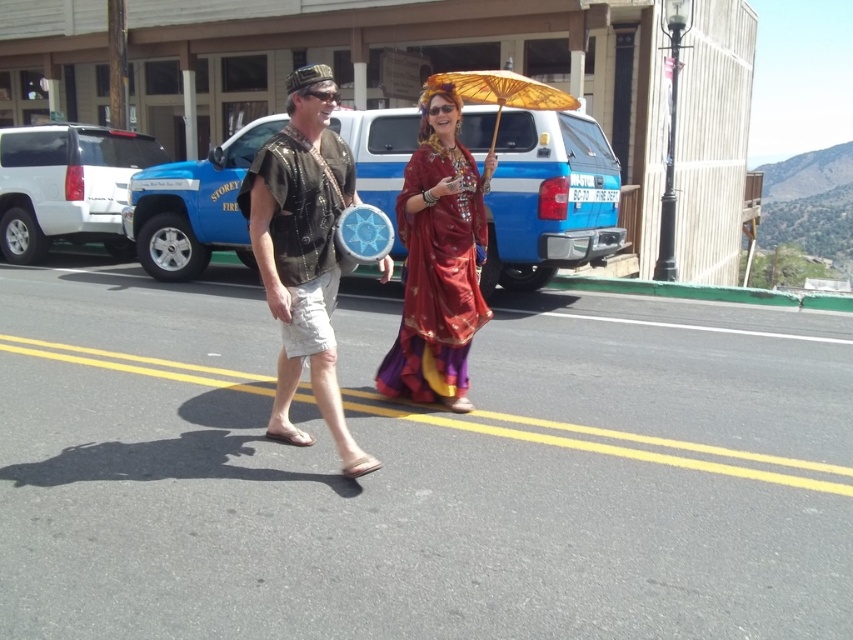
This screenshot has height=640, width=853. In order to click on white matte suv at left in this screenshot , I will do `click(67, 186)`.

Is point (45, 234) farther from viewer compared to point (494, 80)?

Yes, it is.

Find the location of a particular element. white matte suv at left is located at coordinates [67, 186].

Does blue metallic truck at center appear under wooden parasol at center?

Yes, blue metallic truck at center is below wooden parasol at center.

Who is positioned more to the left, blue metallic truck at center or wooden parasol at center?

Positioned to the left is blue metallic truck at center.

Is point (393, 109) closer to viewer compared to point (517, 102)?

No.

Image resolution: width=853 pixels, height=640 pixels. Identify the location of blue metallic truck at center. (549, 198).

Who is lower down, shiny red fabric dress at center or wooden parasol at center?

shiny red fabric dress at center is below.

Is point (480, 205) positioned after point (570, 100)?

No, it is not.

Does point (479, 225) lie behind point (518, 74)?

No, it is not.

Find the location of a particular element. shiny red fabric dress at center is located at coordinates (438, 260).